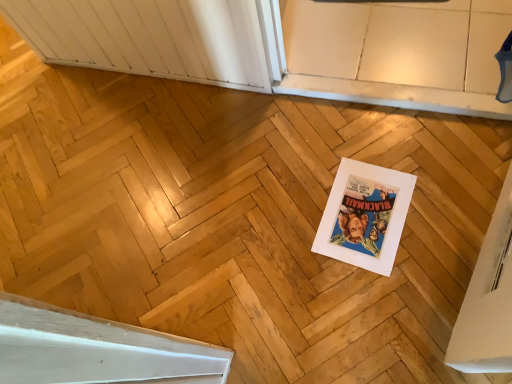
Where is `vacant region above white paper comic book at center (from a real-world perspective)`? vacant region above white paper comic book at center (from a real-world perspective) is located at coordinates (367, 211).